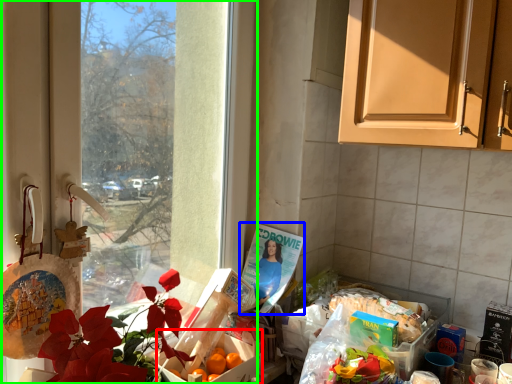
Question: Based on their relative distances, which object is nearer to box (highlighted by a red box)? Choose from magazine (highlighted by a blue box) and window (highlighted by a green box).

Choices:
 (A) magazine
 (B) window

Answer: (A)